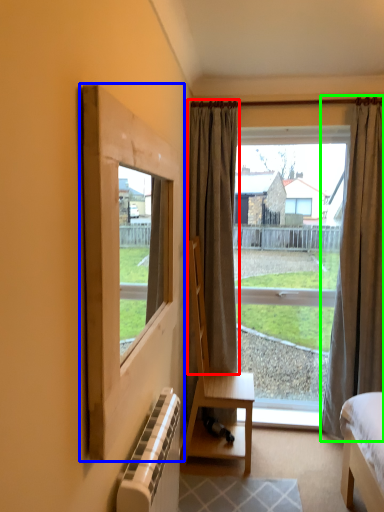
Question: Which object is the farthest from curtain (highlighted by a red box)? Choose among these: window frame (highlighted by a blue box) or curtain (highlighted by a green box).

Choices:
 (A) window frame
 (B) curtain

Answer: (A)